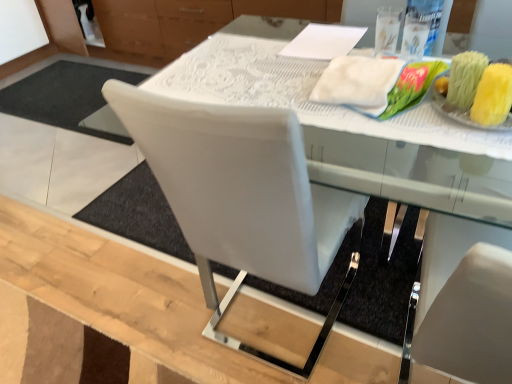
Question: Is white fluffy cloth at upper right located outside white leather chair at center?

Choices:
 (A) yes
 (B) no

Answer: (B)

Question: Can you confirm if white fluffy cloth at upper right is shorter than white leather chair at center?

Choices:
 (A) no
 (B) yes

Answer: (B)

Question: Considering the relative positions of white fluffy cloth at upper right and white leather chair at center in the image provided, is white fluffy cloth at upper right to the right of white leather chair at center from the viewer's perspective?

Choices:
 (A) yes
 (B) no

Answer: (A)

Question: Is white fluffy cloth at upper right positioned behind white leather chair at center?

Choices:
 (A) yes
 (B) no

Answer: (A)

Question: Is white fluffy cloth at upper right at the left side of white leather chair at center?

Choices:
 (A) yes
 (B) no

Answer: (B)

Question: Is white fluffy cloth at upper right wider than white leather chair at center?

Choices:
 (A) no
 (B) yes

Answer: (A)

Question: Is white lace tablecloth at center taller than white fluffy cloth at upper right?

Choices:
 (A) yes
 (B) no

Answer: (B)

Question: From the image's perspective, is white lace tablecloth at center below white fluffy cloth at upper right?

Choices:
 (A) yes
 (B) no

Answer: (B)

Question: Is white lace tablecloth at center oriented towards white fluffy cloth at upper right?

Choices:
 (A) yes
 (B) no

Answer: (B)

Question: Does white lace tablecloth at center lie behind white fluffy cloth at upper right?

Choices:
 (A) no
 (B) yes

Answer: (A)

Question: Does white lace tablecloth at center lie in front of white fluffy cloth at upper right?

Choices:
 (A) no
 (B) yes

Answer: (B)

Question: Is white lace tablecloth at center surrounding white fluffy cloth at upper right?

Choices:
 (A) yes
 (B) no

Answer: (B)

Question: Are white lace tablecloth at center and white leather chair at center far apart?

Choices:
 (A) no
 (B) yes

Answer: (A)